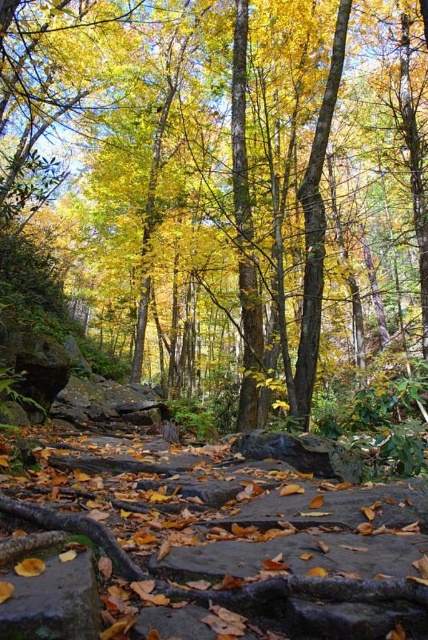
Is point (6, 182) closer to viewer compared to point (70, 560)?

That is False.

The image size is (428, 640). What do you see at coordinates (222, 179) in the screenshot?
I see `yellow leaves at center` at bounding box center [222, 179].

Find the location of `yellow leaves at center`. yellow leaves at center is located at coordinates (222, 179).